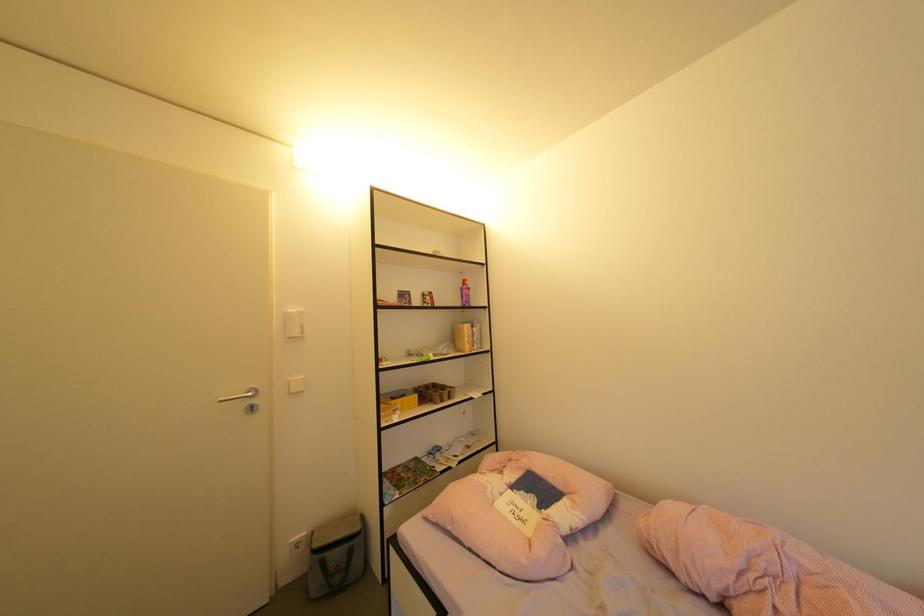
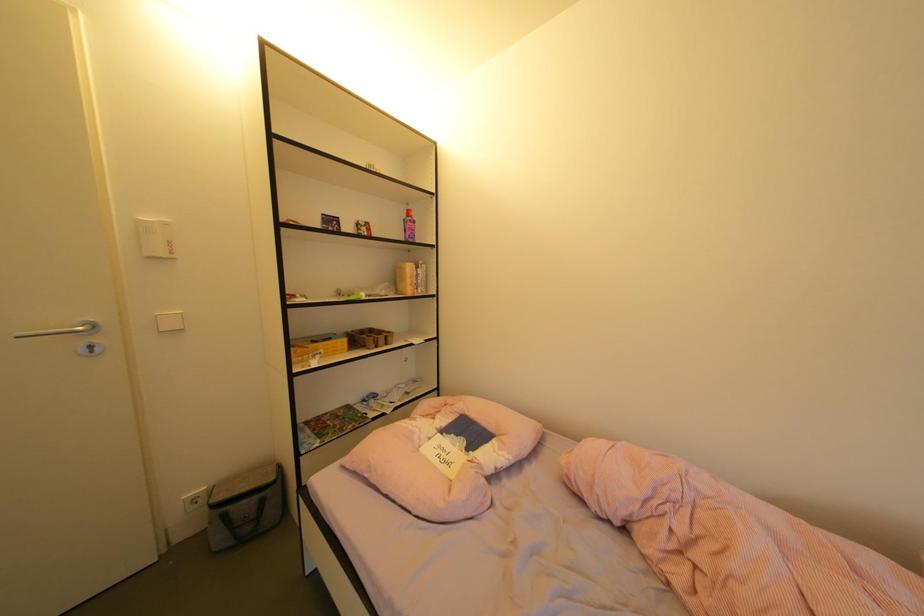
In a continuous first-person perspective shot, in which direction is the camera moving?

The cameraman moved toward right, forward.